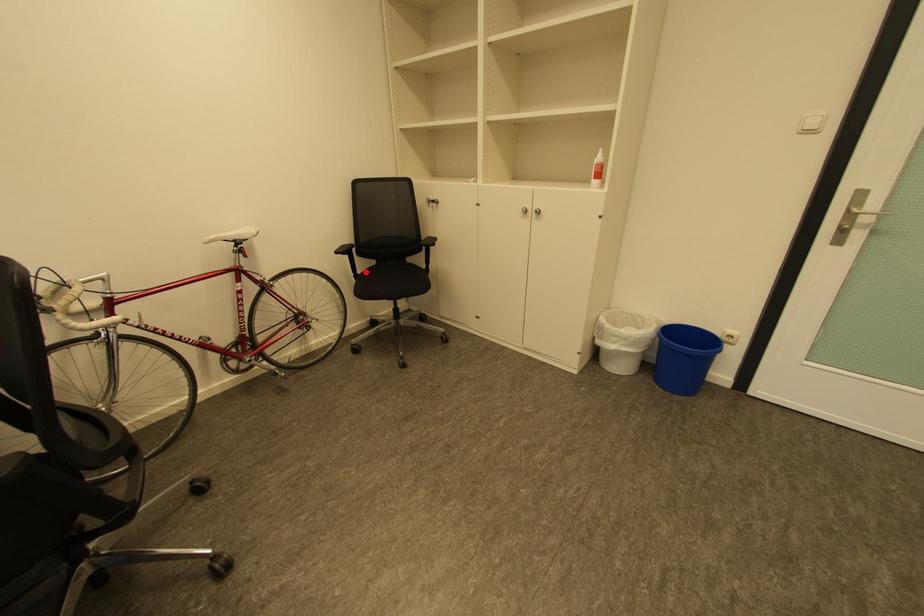
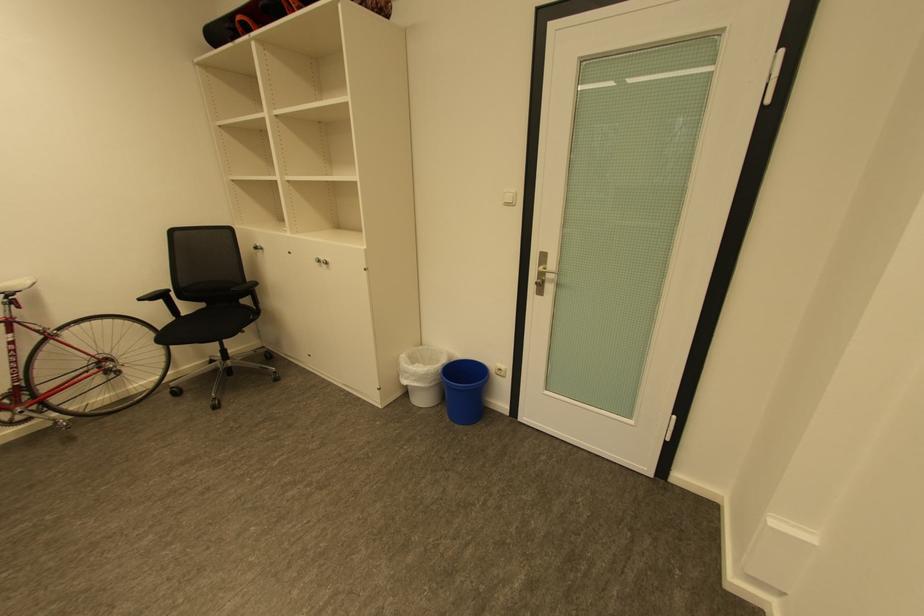
Locate, in the second image, the point that corresponds to the highlighted location in the first image.

(190, 315)